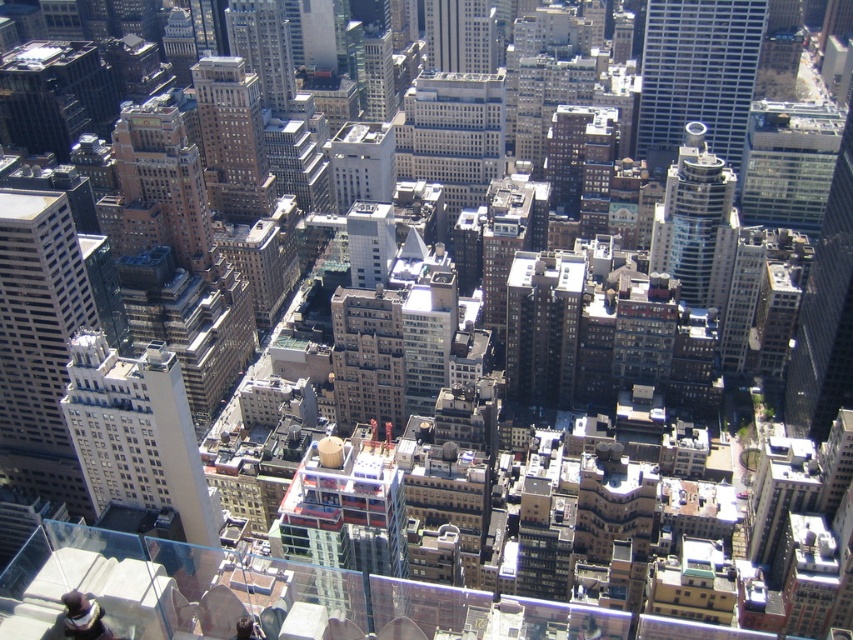
Question: Does red brick building at center have a lesser width compared to brown brick building at upper left?

Choices:
 (A) no
 (B) yes

Answer: (A)

Question: Which point is closer to the camera taking this photo?

Choices:
 (A) (706, 301)
 (B) (198, 70)
 (C) (201, 234)
 (D) (453, 120)

Answer: (D)

Question: Which of the following is the closest to the observer?

Choices:
 (A) (665, 138)
 (B) (251, 141)

Answer: (B)

Question: Can you confirm if white smooth building at left is positioned above glassy steel skyscraper at upper right?

Choices:
 (A) yes
 (B) no

Answer: (B)

Question: Is white smooth building at left to the left of white smooth building at center from the viewer's perspective?

Choices:
 (A) yes
 (B) no

Answer: (A)

Question: Estimate the real-world distances between objects in this image. Which object is farther from the white smooth building at center?

Choices:
 (A) brown brick building at center
 (B) white smooth building at left

Answer: (B)